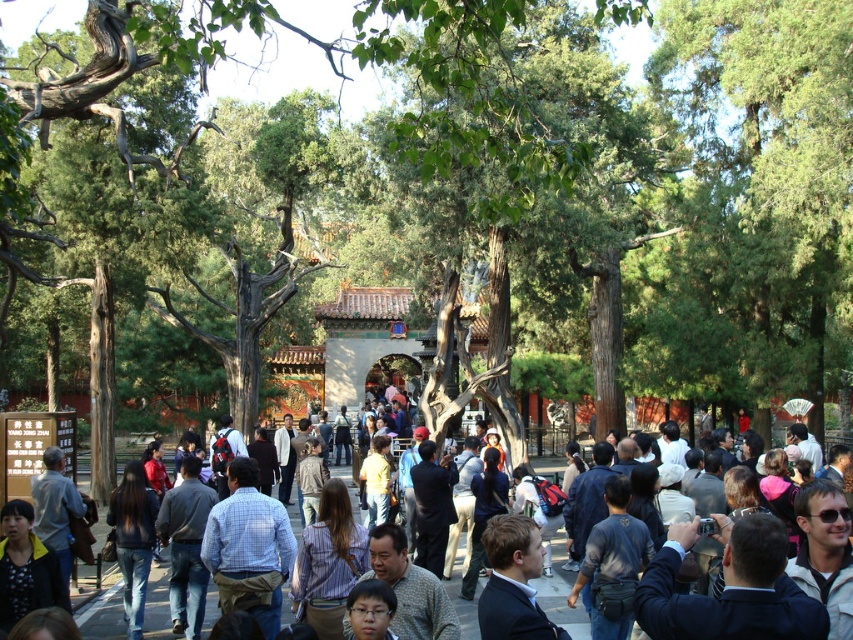
Is the position of multicolored casual clothing at center more distant than that of dark blue jeans at lower left?

That is False.

Measure the distance between multicolored casual clothing at center and camera.

multicolored casual clothing at center and camera are 56.39 meters apart.

The image size is (853, 640). I want to click on multicolored casual clothing at center, so click(561, 596).

Is dark gray fabric backpack at center taller than dark blue jeans at lower left?

No.

The width and height of the screenshot is (853, 640). What do you see at coordinates (612, 564) in the screenshot? I see `dark gray fabric backpack at center` at bounding box center [612, 564].

Locate an element on the screen. dark gray fabric backpack at center is located at coordinates (612, 564).

Measure the distance between multicolored casual clothing at center and dark blue shirt at center.

multicolored casual clothing at center and dark blue shirt at center are 24.36 feet apart from each other.

Is point (556, 611) positioned before point (477, 525)?

Yes, it is.

What are the coordinates of `multicolored casual clothing at center` in the screenshot? It's located at point(561,596).